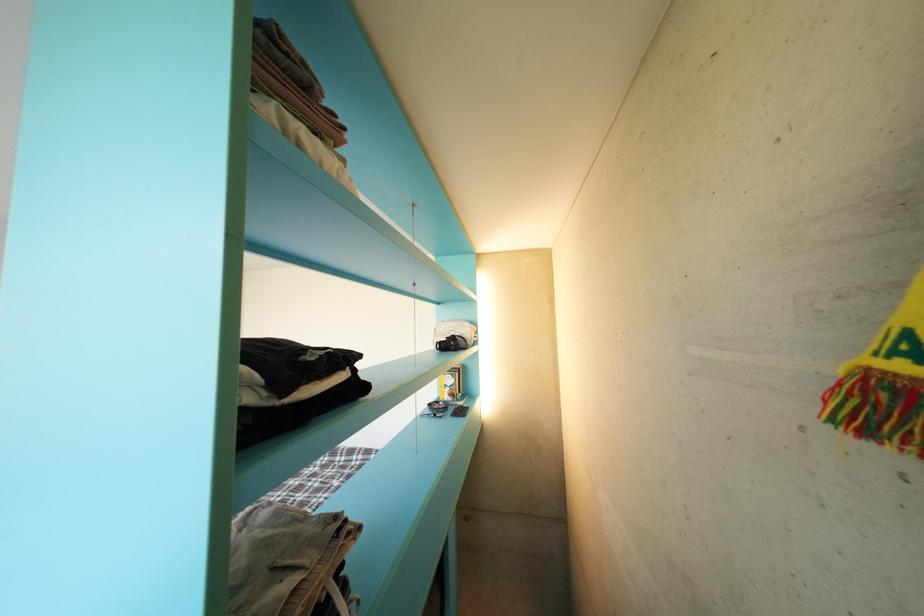
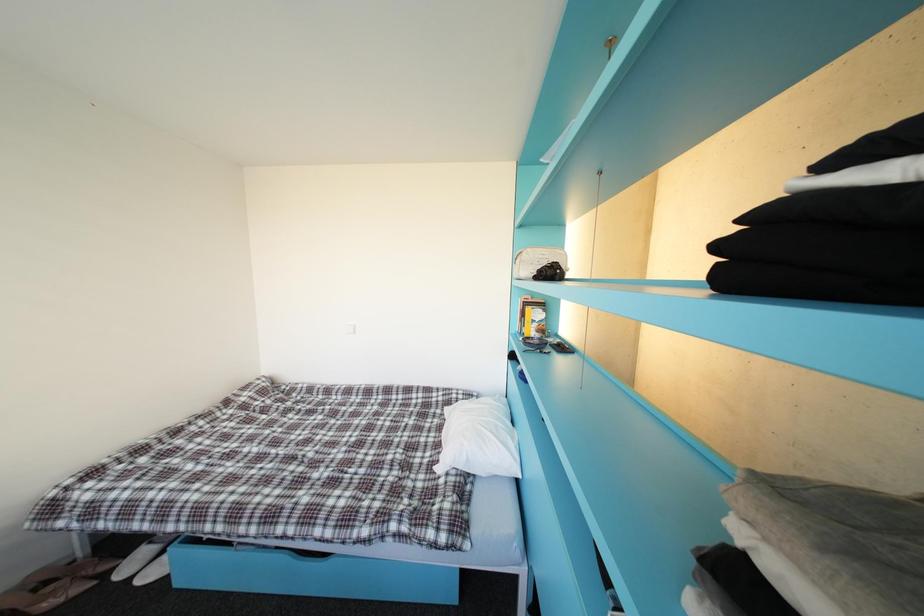
The images are taken continuously from a first-person perspective. In which direction are you moving?

The movement direction of the cameraman is left, forward.